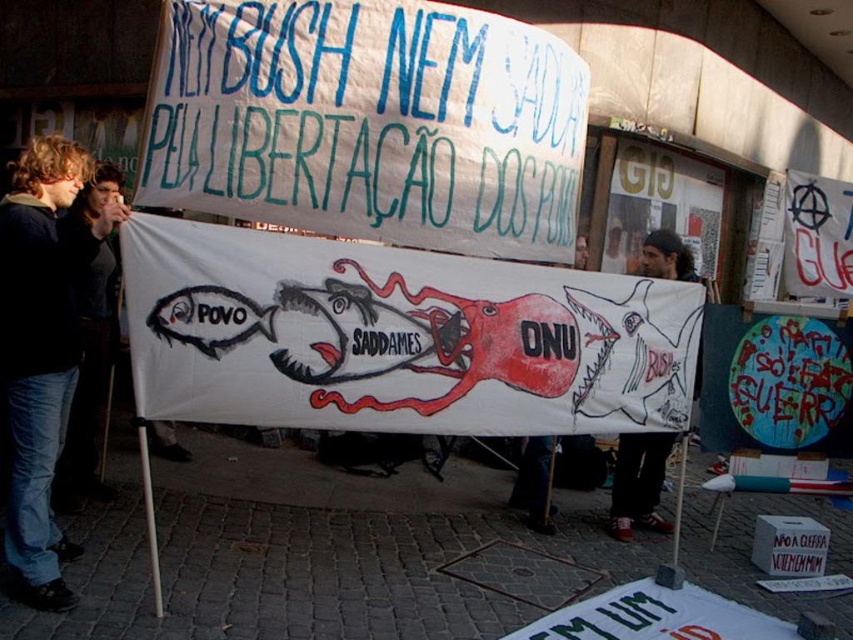
Between white paper banner at upper center and jeans at left, which one is positioned higher?

white paper banner at upper center is above.

Is white paper banner at upper center above jeans at left?

Yes.

Locate an element on the screen. This screenshot has width=853, height=640. white paper banner at upper center is located at coordinates (369, 122).

Can you confirm if white paper banner at center is thinner than white paper banner at upper center?

Incorrect, white paper banner at center's width is not less than white paper banner at upper center's.

Locate an element on the screen. This screenshot has height=640, width=853. white paper banner at center is located at coordinates (396, 337).

From the picture: Can you confirm if jeans at left is wider than dark gray knit cap at upper center?

Yes.

Is jeans at left above dark gray knit cap at upper center?

Correct, jeans at left is located above dark gray knit cap at upper center.

What do you see at coordinates (39, 353) in the screenshot? The height and width of the screenshot is (640, 853). I see `jeans at left` at bounding box center [39, 353].

Where is `jeans at left`? jeans at left is located at coordinates (39, 353).